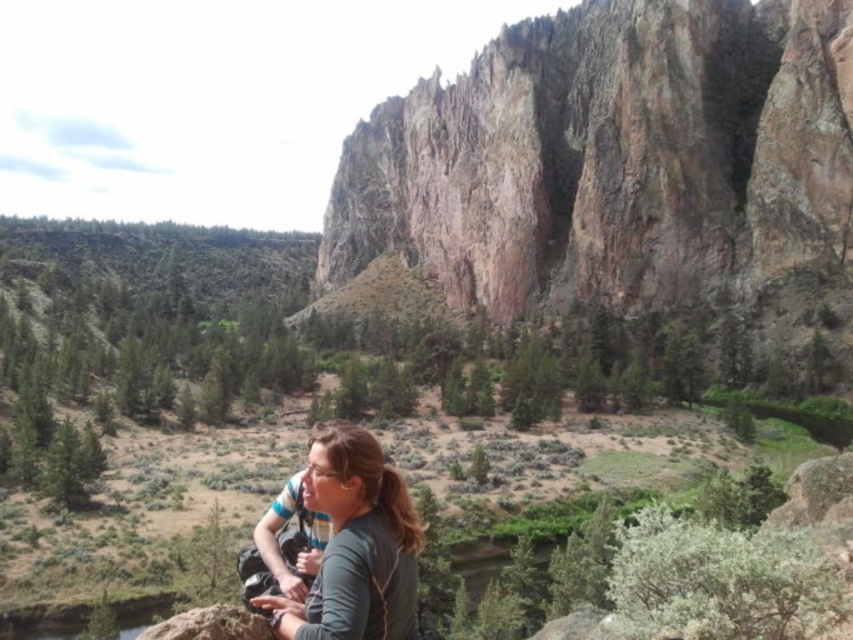
Is rustic rock cliff at upper right wider than brown rough rock at lower left?

Indeed, rustic rock cliff at upper right has a greater width compared to brown rough rock at lower left.

Is rustic rock cliff at upper right to the left of brown rough rock at lower left from the viewer's perspective?

In fact, rustic rock cliff at upper right is to the right of brown rough rock at lower left.

What do you see at coordinates (612, 160) in the screenshot? The image size is (853, 640). I see `rustic rock cliff at upper right` at bounding box center [612, 160].

Find the location of a particular element. The image size is (853, 640). rustic rock cliff at upper right is located at coordinates (612, 160).

Does gray matte shirt at center have a lesser height compared to brown rough rock at lower left?

Yes.

Between point (339, 561) and point (215, 627), which one is positioned in front?

Positioned in front is point (215, 627).

Is point (355, 460) positioned in front of point (164, 625)?

No, it is behind (164, 625).

Image resolution: width=853 pixels, height=640 pixels. In order to click on gray matte shirt at center in this screenshot , I will do `click(355, 545)`.

Between point (805, 96) and point (384, 593), which one is positioned in front?

Positioned in front is point (384, 593).

At what (x,y) coordinates should I click in order to perform the action: click on rustic rock cliff at upper right. Please return your answer as a coordinate pair (x, y). This screenshot has height=640, width=853. Looking at the image, I should click on (612, 160).